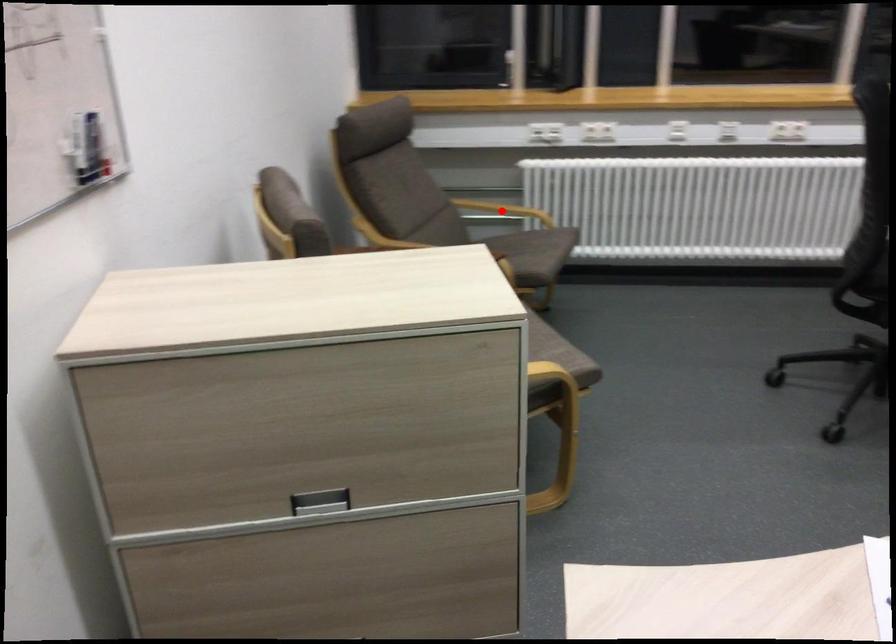
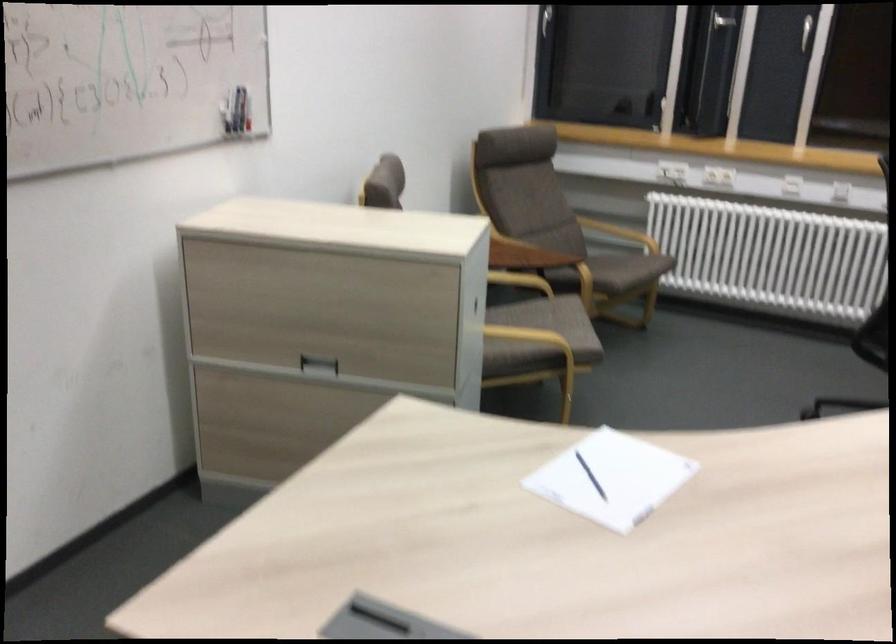
Question: A red point is marked in image1. In image2, is the corresponding 3D point closer to the camera or farther? Reply with the corresponding letter.

Choices:
 (A) The corresponding 3D point is closer.
 (B) The corresponding 3D point is farther.

Answer: (B)